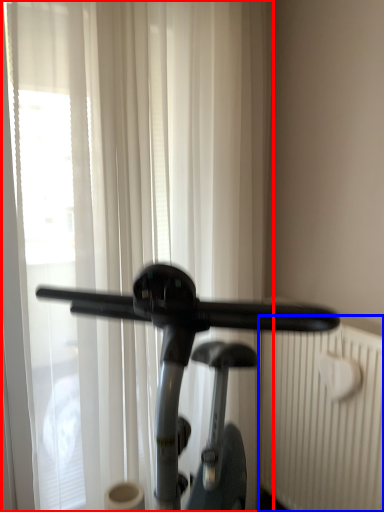
Question: Among these objects, which one is nearest to the camera, curtain (highlighted by a red box) or radiator (highlighted by a blue box)?

Choices:
 (A) curtain
 (B) radiator

Answer: (A)